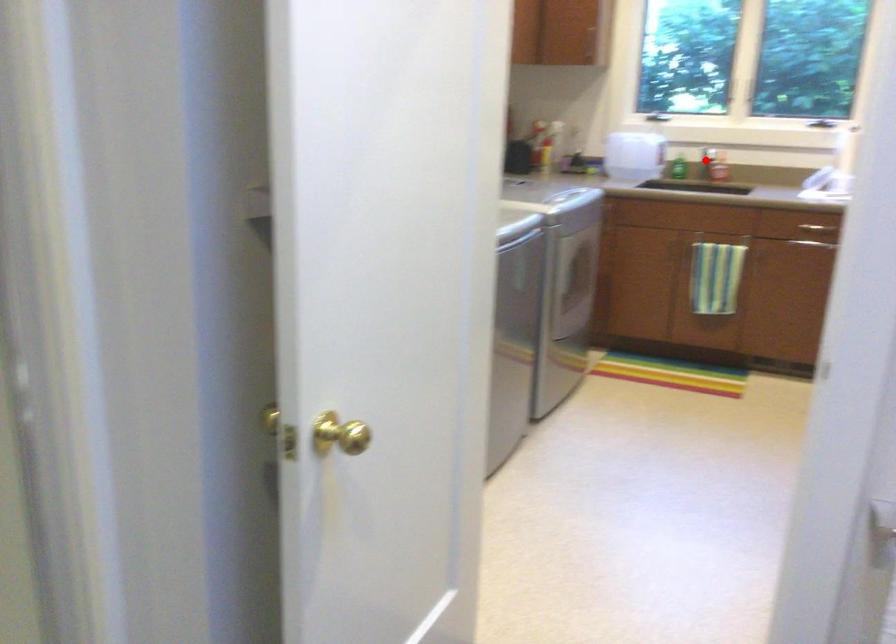
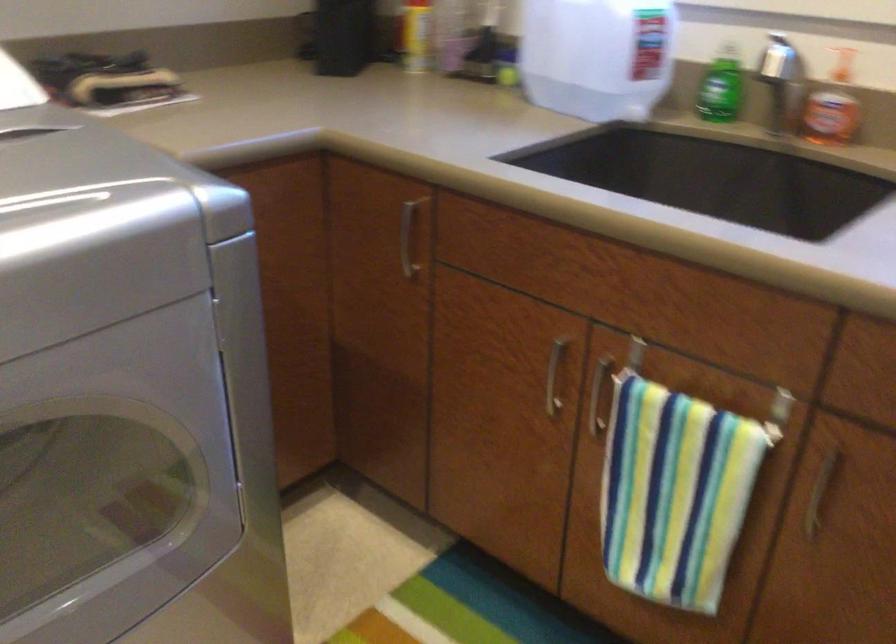
Question: I am providing you with two images of the same scene from different viewpoints. Image1 has a red point marked. In image2, the corresponding 3D location appears at what relative position? Reply with the corresponding letter.

Choices:
 (A) Closer
 (B) Farther

Answer: (A)